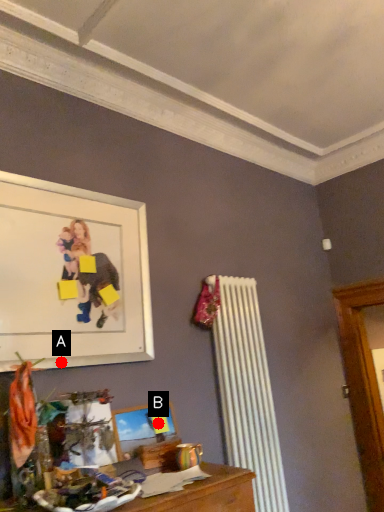
Question: Two points are circled on the image, labeled by A and B beside each circle. Which point is further to the camera?

Choices:
 (A) A is further
 (B) B is further

Answer: (B)